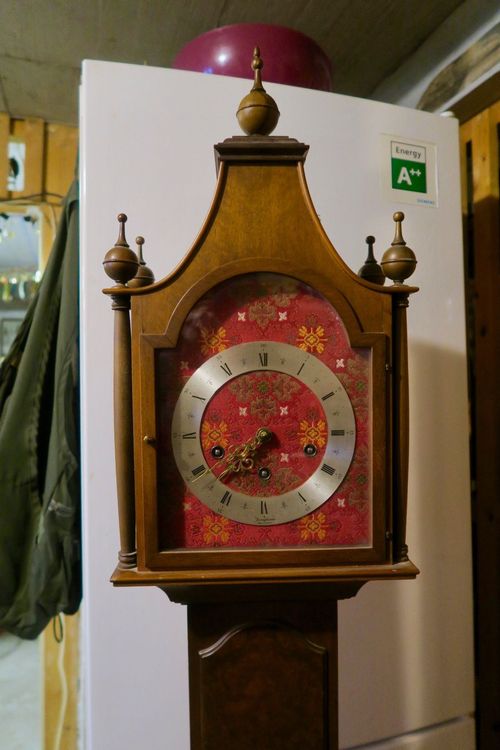
Where is `ceiling`? The height and width of the screenshot is (750, 500). ceiling is located at coordinates pyautogui.click(x=75, y=46), pyautogui.click(x=71, y=102), pyautogui.click(x=381, y=34).